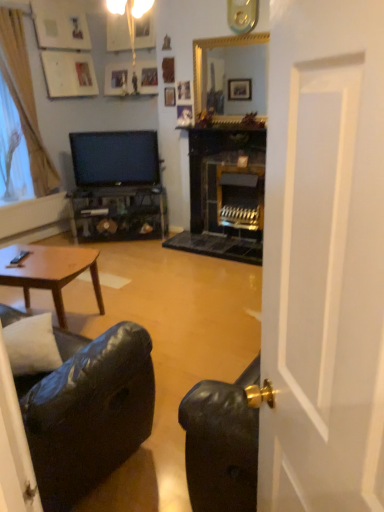
The height and width of the screenshot is (512, 384). In order to click on blank space situated above brown wooden coffee table at lower left (from a real-world perspective) in this screenshot , I will do `click(35, 263)`.